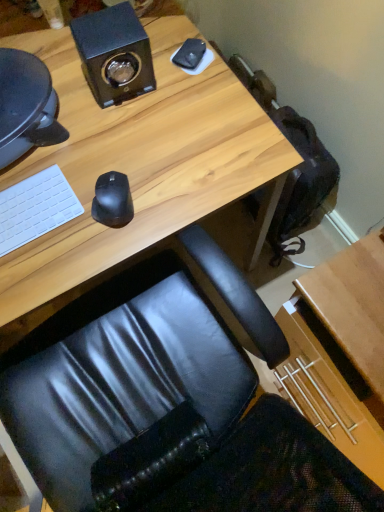
Image resolution: width=384 pixels, height=512 pixels. Describe the element at coordinates (114, 54) in the screenshot. I see `black matte speaker at upper left` at that location.

The width and height of the screenshot is (384, 512). What do you see at coordinates (139, 169) in the screenshot?
I see `wooden desk at center` at bounding box center [139, 169].

The width and height of the screenshot is (384, 512). In order to click on black matte mouse at center in this screenshot , I will do `click(112, 200)`.

Based on the photo, is wooden desk at center shorter than white matte keyboard at left?

In fact, wooden desk at center may be taller than white matte keyboard at left.

Considering the sizes of wooden desk at center and white matte keyboard at left in the image, is wooden desk at center wider or thinner than white matte keyboard at left?

Clearly, wooden desk at center has more width compared to white matte keyboard at left.

From the image's perspective, is wooden desk at center under white matte keyboard at left?

No.

From the image's perspective, is black matte mouse at center over white matte keyboard at left?

Yes, from the image's perspective, black matte mouse at center is over white matte keyboard at left.

Consider the image. Which point is more forward, (x=107, y=187) or (x=22, y=244)?

Point (x=22, y=244)

Is black matte mouse at center further to camera compared to white matte keyboard at left?

Yes, black matte mouse at center is behind white matte keyboard at left.

Locate an element on the screen. This screenshot has height=512, width=384. laptop keyboard to the left of black matte mouse at center is located at coordinates (35, 208).

Is black matte speaker at upper left positioned far away from black leather chair at center?

Actually, black matte speaker at upper left and black leather chair at center are a little close together.

Considering the relative sizes of black matte speaker at upper left and black leather chair at center in the image provided, is black matte speaker at upper left bigger than black leather chair at center?

No, black matte speaker at upper left is not bigger than black leather chair at center.

Considering the points (146, 74) and (132, 463), which point is in front, point (146, 74) or point (132, 463)?

The point (132, 463) is closer to the camera.

Considering the positions of objects black matte speaker at upper left and black leather chair at center in the image provided, who is more to the right, black matte speaker at upper left or black leather chair at center?

Positioned to the right is black leather chair at center.

How different are the orientations of white matte keyboard at left and black leather chair at center in degrees?

white matte keyboard at left and black leather chair at center are facing 178 degrees away from each other.

Based on the photo, from the image's perspective, which object appears higher, white matte keyboard at left or black leather chair at center?

white matte keyboard at left is shown above in the image.

The image size is (384, 512). I want to click on laptop keyboard to the left of black leather chair at center, so click(35, 208).

Is white matte keyboard at left located outside black leather chair at center?

Absolutely, white matte keyboard at left is external to black leather chair at center.

From the image's perspective, which is above, white matte keyboard at left or black matte speaker at upper left?

From the image's view, black matte speaker at upper left is above.

From a real-world perspective, who is located higher, white matte keyboard at left or black matte speaker at upper left?

In real-world perspective, black matte speaker at upper left is above.

Is white matte keyboard at left surrounding black matte speaker at upper left?

No, black matte speaker at upper left is located outside of white matte keyboard at left.

Is black matte speaker at upper left further to camera compared to black matte mouse at center?

Yes, the depth of black matte speaker at upper left is greater than that of black matte mouse at center.

From the picture: Which of these two, black matte speaker at upper left or black matte mouse at center, stands taller?

With more height is black matte speaker at upper left.

What's the angular difference between black matte speaker at upper left and black matte mouse at center's facing directions?

There is a 15.7-degree angle between the facing directions of black matte speaker at upper left and black matte mouse at center.

Is point (122, 16) closer or farther from the camera than point (114, 193)?

Point (122, 16) is farther from the camera than point (114, 193).

Is black leather chair at center facing away from black matte mouse at center?

No, black leather chair at center's orientation is not away from black matte mouse at center.

Considering the positions of objects black leather chair at center and black matte mouse at center in the image provided, who is more to the left, black leather chair at center or black matte mouse at center?

black matte mouse at center is more to the left.

Where is `mouse to the left of black leather chair at center`? mouse to the left of black leather chair at center is located at coordinates (112, 200).

Which of these two, black leather chair at center or black matte mouse at center, stands taller?

Standing taller between the two is black leather chair at center.

Locate an element on the screen. laptop keyboard located below the wooden desk at center (from the image's perspective) is located at coordinates (35, 208).

Identify the location of mouse behind the white matte keyboard at left. The image size is (384, 512). (112, 200).

From the image, which object appears to be farther from black matte speaker at upper left, black leather chair at center or white matte keyboard at left?

Based on the image, black leather chair at center appears to be further to black matte speaker at upper left.

Looking at this image, estimate the real-world distances between objects in this image. Which object is closer to black leather chair at center, wooden desk at center or black matte mouse at center?

wooden desk at center is closer to black leather chair at center.

From the image, which object appears to be nearer to white matte keyboard at left, black matte mouse at center or black leather chair at center?

black matte mouse at center lies closer to white matte keyboard at left than the other object.

Looking at this image, when comparing their distances from black matte speaker at upper left, does wooden desk at center or black matte mouse at center seem further?

black matte mouse at center lies further to black matte speaker at upper left than the other object.

Estimate the real-world distances between objects in this image. Which object is closer to wooden desk at center, black leather chair at center or black matte mouse at center?

black matte mouse at center is closer to wooden desk at center.

When comparing their distances from white matte keyboard at left, does black matte speaker at upper left or black matte mouse at center seem further?

black matte speaker at upper left lies further to white matte keyboard at left than the other object.

When comparing their distances from wooden desk at center, does black matte speaker at upper left or white matte keyboard at left seem closer?

Based on the image, black matte speaker at upper left appears to be nearer to wooden desk at center.

When comparing their distances from wooden desk at center, does black matte mouse at center or black leather chair at center seem further?

black leather chair at center is positioned further to the anchor wooden desk at center.

Where is `desk between black leather chair at center and black matte mouse at center in the front-back direction`? The height and width of the screenshot is (512, 384). desk between black leather chair at center and black matte mouse at center in the front-back direction is located at coordinates (139, 169).

This screenshot has height=512, width=384. I want to click on desk between black matte speaker at upper left and black matte mouse at center from top to bottom, so click(x=139, y=169).

I want to click on mouse located between black leather chair at center and black matte speaker at upper left in the depth direction, so click(112, 200).

What are the coordinates of `mouse between black matte speaker at upper left and white matte keyboard at left in the vertical direction` in the screenshot? It's located at (112, 200).